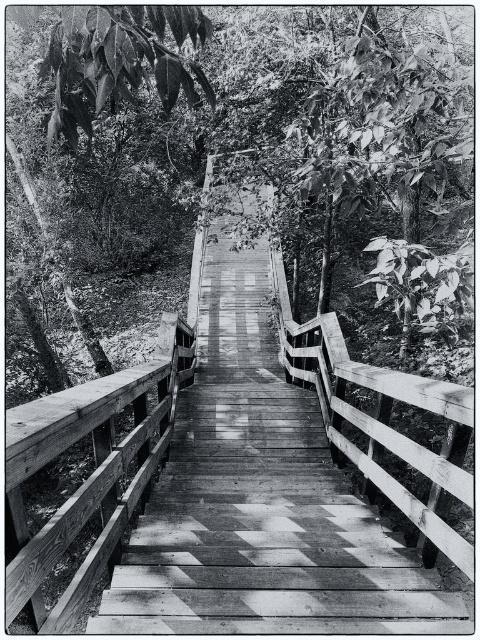
Question: Which point is closer to the camera?

Choices:
 (A) (153, 196)
 (B) (216, 435)

Answer: (B)

Question: Which of the following is the closest to the observer?

Choices:
 (A) (336, 241)
 (B) (247, 320)

Answer: (A)

Question: Is smooth green leaves at upper center smaller than wooden bridge at center?

Choices:
 (A) yes
 (B) no

Answer: (B)

Question: Can you confirm if smooth green leaves at upper center is positioned to the right of wooden bridge at center?

Choices:
 (A) no
 (B) yes

Answer: (B)

Question: Is smooth green leaves at upper center below wooden bridge at center?

Choices:
 (A) no
 (B) yes

Answer: (A)

Question: Which object appears farthest from the camera in this image?

Choices:
 (A) smooth green leaves at upper center
 (B) wooden bridge at center

Answer: (A)